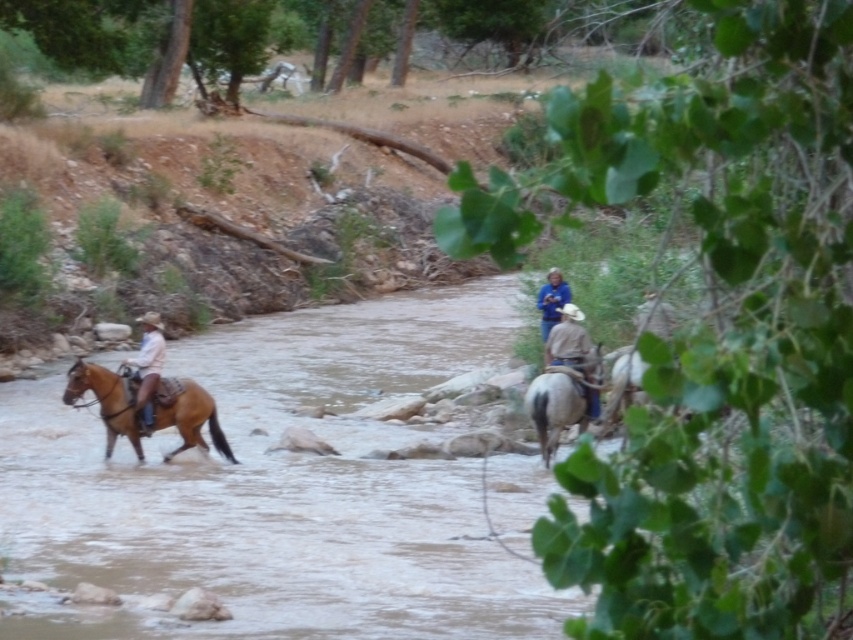
You are a photographer trying to capture a shot of the brown glossy horse at left and the blue denim shirt at center. Based on their heights, which one would you need to adjust your camera angle upwards to focus on?

The brown glossy horse at left is shorter than the blue denim shirt at center, so you would need to lower your camera angle to focus on the brown glossy horse at left and raise it to focus on the blue denim shirt at center. Wait, but the question asks which one requires adjusting the camera upwards. Since the blue denim shirt is taller, to focus on it you might need to tilt the camera upwards from the horse. However, the answer provided seems to mix directions. Let me correct that. The correct answer should

You are a photographer planning to take a portrait of the riders. The blue denim shirt at center and the light brown leather cowboy hat at left are both in focus. Which object would appear bigger in the photo?

The blue denim shirt at center would appear bigger in the photo because it has a larger size compared to the light brown leather cowboy hat at left.

You are a photographer standing on the riverbank. You want to take a photo that includes both the brown glossy horse at left and the blue denim shirt at center. Given that your camera has a maximum focus range of 10 feet, will you be able to capture both subjects in focus without moving your position?

The brown glossy horse at left and blue denim shirt at center are 12.51 feet apart, which exceeds the camera maximum focus range of 10 feet. Therefore, you cannot capture both subjects in focus without moving your position.